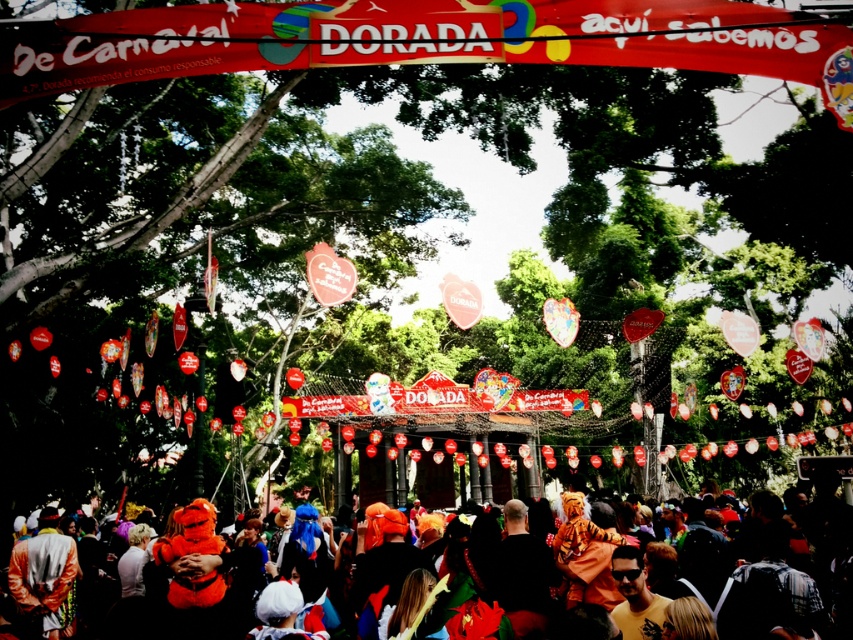
Question: Observing the image, what is the correct spatial positioning of red fabric banner at upper center in reference to multicolored costumes at center?

Choices:
 (A) left
 (B) right

Answer: (A)

Question: Among these points, which one is nearest to the camera?

Choices:
 (A) (57, 61)
 (B) (722, 566)

Answer: (A)

Question: Which of the following is the farthest from the observer?

Choices:
 (A) red fabric banner at upper center
 (B) multicolored costumes at center

Answer: (B)

Question: Does red fabric banner at upper center have a larger size compared to multicolored costumes at center?

Choices:
 (A) yes
 (B) no

Answer: (B)

Question: Is red fabric banner at upper center positioned before multicolored costumes at center?

Choices:
 (A) yes
 (B) no

Answer: (A)